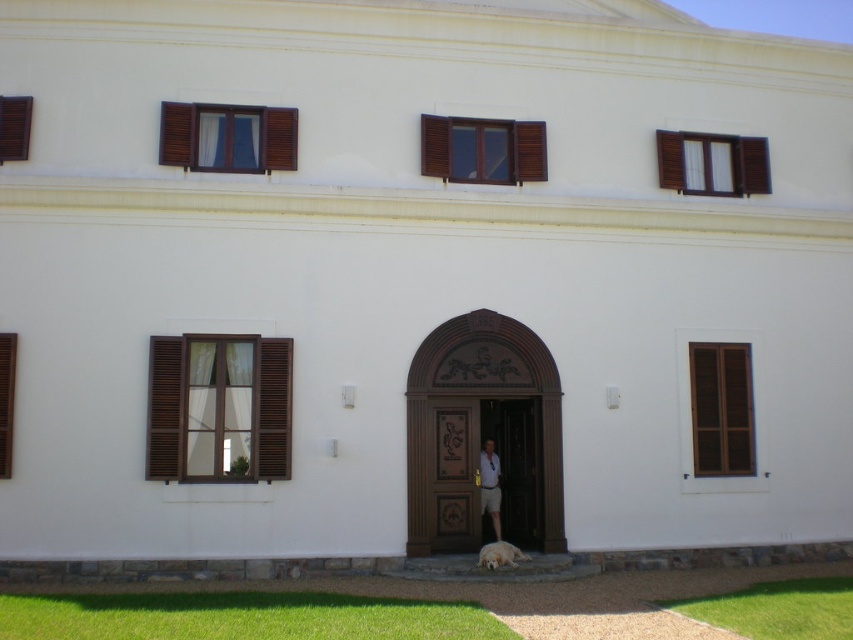
You are standing in front of the building and want to enter. Which object is closer to you, the wooden carved door at center or the brown wooden shutter at left?

The wooden carved door at center is closer to you than the brown wooden shutter at left because it is further to the viewer.

You are a delivery person approaching the building and need to enter through the correct entrance. The instructions say to go through the larger wooden structure. Which one should you choose between the brown polished wood door at center and the wooden at center?

The brown polished wood door at center has a larger size compared to wooden at center, so you should choose the brown polished wood door at center as the correct entrance.

You are standing in front of the building and want to take a photo of the wooden carved door at center. If your camera can focus on objects up to 50 feet away, will it be able to capture the door clearly?

The wooden carved door at center is 44.45 feet away from camera, so yes, the camera can focus on the door clearly since it is within the 50 feet range.